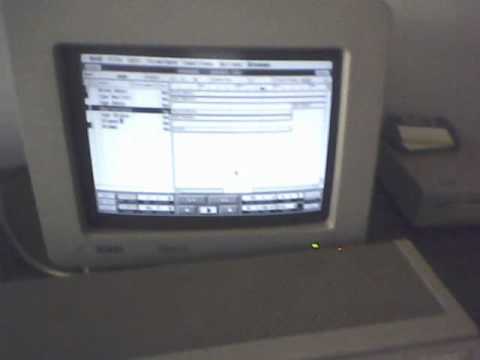
Where is `green light`? green light is located at coordinates (315, 246).